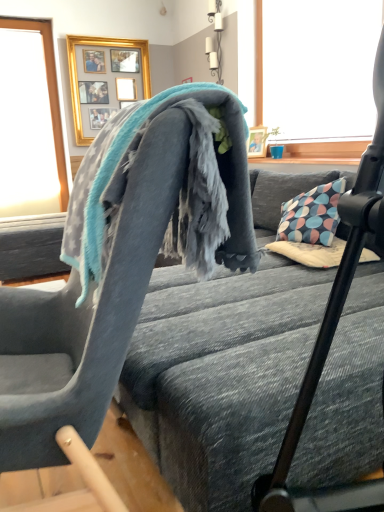
Question: From a real-world perspective, relative to transparent glass window at upper left, is soft gray fabric bed frame at center vertically above or below?

Choices:
 (A) above
 (B) below

Answer: (B)

Question: In terms of width, does soft gray fabric bed frame at center look wider or thinner when compared to transparent glass window at upper left?

Choices:
 (A) wide
 (B) thin

Answer: (A)

Question: Which is nearer to the gold framed picture at upper center?

Choices:
 (A) soft gray fabric bed frame at center
 (B) soft gray fabric chair at upper center
 (C) gray fleece blanket at center
 (D) transparent glass window at upper left

Answer: (D)

Question: Based on their relative distances, which object is farther from the soft gray fabric chair at upper center?

Choices:
 (A) transparent glass window at upper left
 (B) gold framed picture at upper center
 (C) soft gray fabric bed frame at center
 (D) gray fleece blanket at center

Answer: (B)